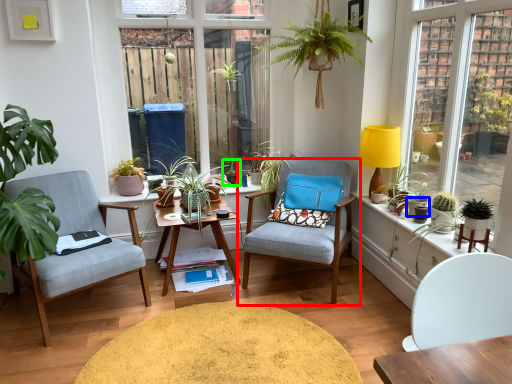
Question: Which is farther away from chair (highlighted by a red box)? flowerpot (highlighted by a blue box) or houseplant (highlighted by a green box)?

Choices:
 (A) flowerpot
 (B) houseplant

Answer: (A)